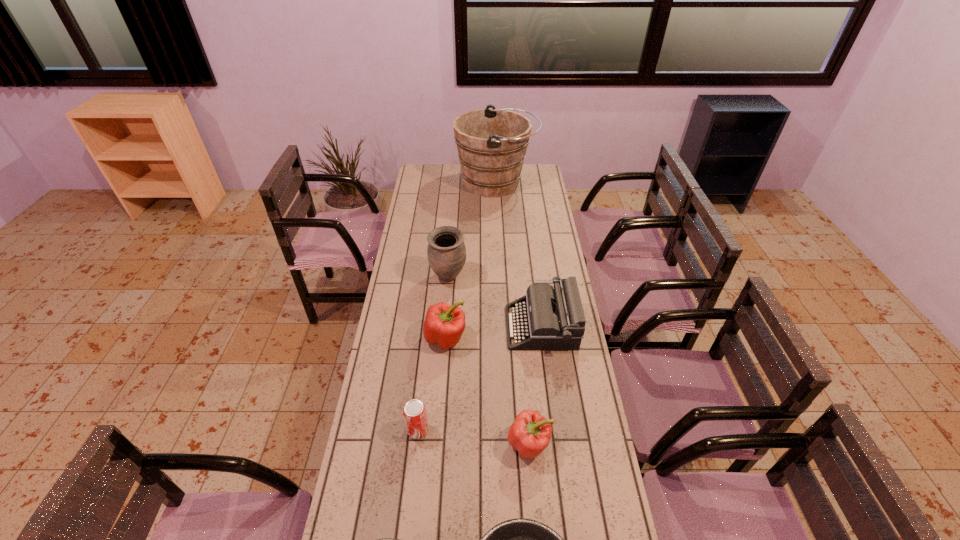
Locate an element on the screen. vacant area between the typewriter and the farthest object is located at coordinates (518, 255).

In order to click on vacant space that's between the farthest object and the typewriter in this screenshot , I will do `click(518, 255)`.

Where is `free space between the typewriter and the soda can`? free space between the typewriter and the soda can is located at coordinates (479, 378).

In order to click on free space between the soda can and the typewriter in this screenshot , I will do `click(479, 378)`.

Locate an element on the screen. This screenshot has height=540, width=960. object that is the second closest to the shortest object is located at coordinates (414, 412).

At what (x,y) coordinates should I click in order to perform the action: click on object that ranks as the sixth closest to the shortest object. Please return your answer as a coordinate pair (x, y). The image size is (960, 540). Looking at the image, I should click on (491, 143).

Find the location of a particular element. The width and height of the screenshot is (960, 540). free space that satisfies the following two spatial constraints: 1. on the front side of the sixth shortest object; 2. on the left side of the left bell pepper is located at coordinates click(x=444, y=338).